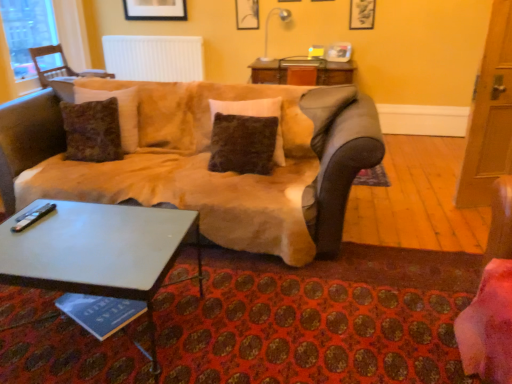
Question: Is fuzzy brown pillow at center next to suede-like beige couch at center?

Choices:
 (A) yes
 (B) no

Answer: (B)

Question: Is fuzzy brown pillow at center shorter than suede-like beige couch at center?

Choices:
 (A) yes
 (B) no

Answer: (A)

Question: Is fuzzy brown pillow at center positioned in front of suede-like beige couch at center?

Choices:
 (A) no
 (B) yes

Answer: (A)

Question: Can you confirm if fuzzy brown pillow at center is wider than suede-like beige couch at center?

Choices:
 (A) no
 (B) yes

Answer: (A)

Question: Is suede-like beige couch at center located within fuzzy brown pillow at center?

Choices:
 (A) yes
 (B) no

Answer: (B)

Question: Is fuzzy brown pillow at center bigger than suede-like beige couch at center?

Choices:
 (A) yes
 (B) no

Answer: (B)

Question: Is white ribbed radiator at upper center outside white glossy coffee table at lower left?

Choices:
 (A) yes
 (B) no

Answer: (A)

Question: Can you confirm if white ribbed radiator at upper center is positioned to the right of white glossy coffee table at lower left?

Choices:
 (A) yes
 (B) no

Answer: (B)

Question: Considering the relative sizes of white ribbed radiator at upper center and white glossy coffee table at lower left in the image provided, is white ribbed radiator at upper center smaller than white glossy coffee table at lower left?

Choices:
 (A) yes
 (B) no

Answer: (A)

Question: Is white ribbed radiator at upper center closer to the viewer compared to white glossy coffee table at lower left?

Choices:
 (A) yes
 (B) no

Answer: (B)

Question: From a real-world perspective, does white ribbed radiator at upper center stand above white glossy coffee table at lower left?

Choices:
 (A) yes
 (B) no

Answer: (A)

Question: From the image's perspective, is white ribbed radiator at upper center on top of white glossy coffee table at lower left?

Choices:
 (A) yes
 (B) no

Answer: (A)

Question: Does matte black picture frame at upper center, the 1th picture frame when ordered from left to right, have a larger size compared to wooden chair at left?

Choices:
 (A) no
 (B) yes

Answer: (A)